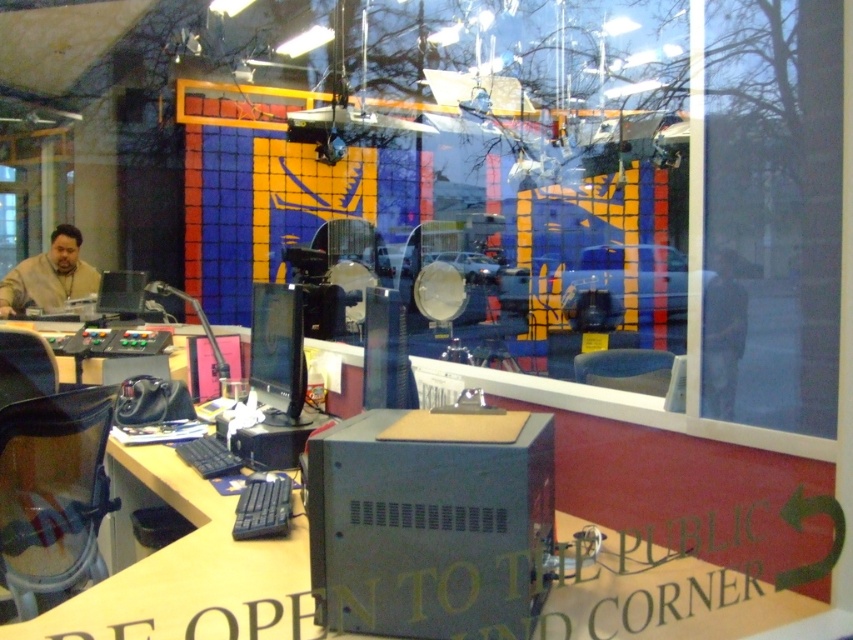
Is metallic gray desk at center behind black plastic keyboard at center?

That is False.

At what (x,y) coordinates should I click in order to perform the action: click on metallic gray desk at center. Please return your answer as a coordinate pair (x, y). This screenshot has width=853, height=640. Looking at the image, I should click on (566, 188).

The image size is (853, 640). Identify the location of metallic gray desk at center. (566, 188).

Which is in front, point (763, 56) or point (248, 524)?

Positioned in front is point (763, 56).

Where is `metallic gray desk at center`? metallic gray desk at center is located at coordinates (566, 188).

Which is more to the left, metallic gray desk at center or matte brown shirt at left?

Answer: From the viewer's perspective, matte brown shirt at left appears more on the left side.

Is metallic gray desk at center taller than matte brown shirt at left?

In fact, metallic gray desk at center may be shorter than matte brown shirt at left.

The height and width of the screenshot is (640, 853). I want to click on metallic gray desk at center, so click(x=566, y=188).